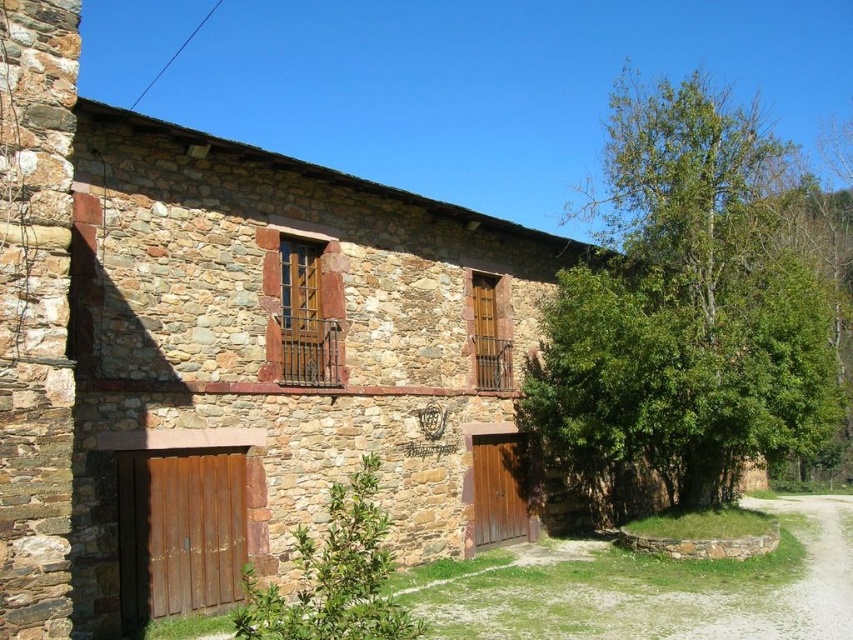
Question: Observing the image, what is the correct spatial positioning of brown stone barn at center in reference to green leafy tree at right?

Choices:
 (A) below
 (B) above

Answer: (A)

Question: Which point is farther to the camera?

Choices:
 (A) brown stone barn at center
 (B) green leafy tree at right

Answer: (B)

Question: Does brown stone barn at center have a smaller size compared to green leafy tree at right?

Choices:
 (A) yes
 (B) no

Answer: (A)

Question: Which point is closer to the camera?

Choices:
 (A) brown stone barn at center
 (B) green leafy tree at right

Answer: (A)

Question: Does brown stone barn at center lie in front of green leafy tree at right?

Choices:
 (A) yes
 (B) no

Answer: (A)